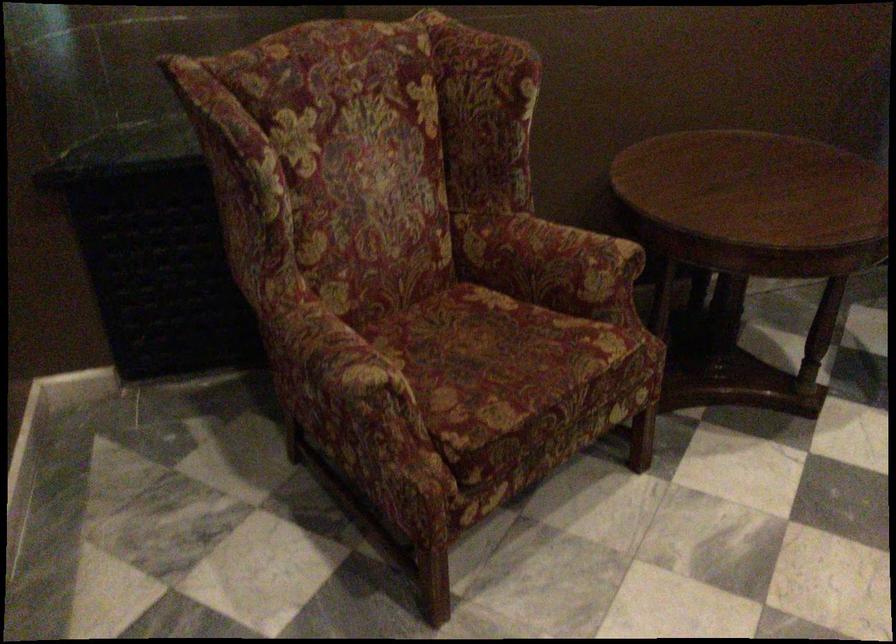
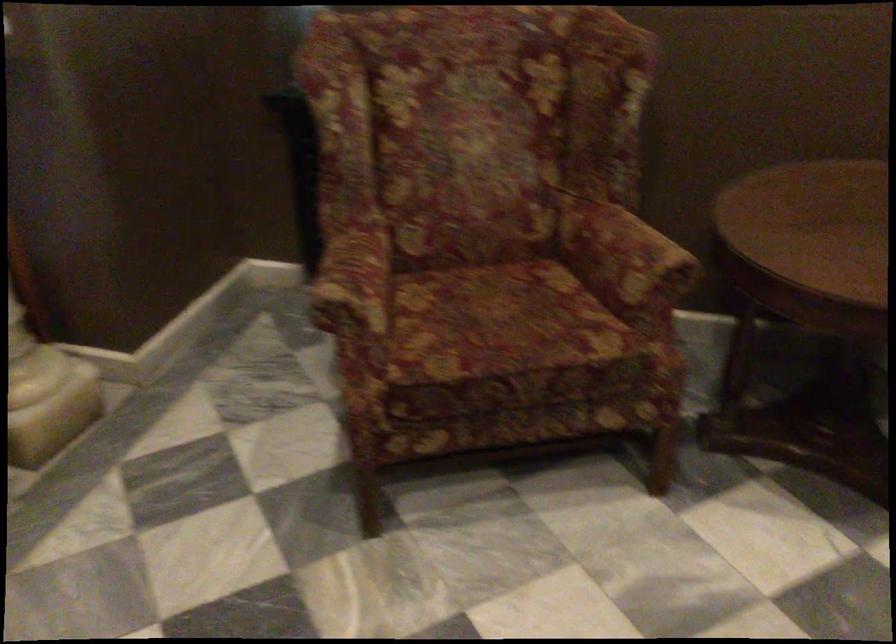
Question: The camera is either moving clockwise (left) or counter-clockwise (right) around the object. The first image is from the beginning of the video and the second image is from the end. Is the camera moving left or right when shooting the video?

Choices:
 (A) Left
 (B) Right

Answer: (B)